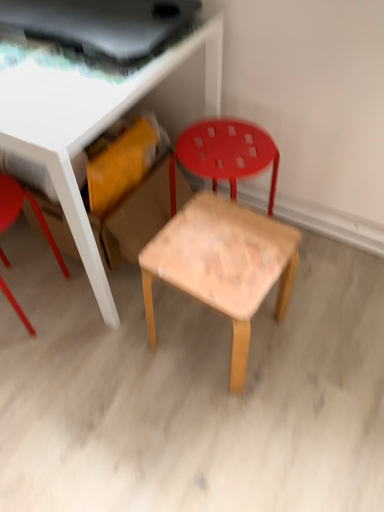
Where is `space that is in front of matte red stool at left, which is the 2th chair from right to left`? This screenshot has width=384, height=512. space that is in front of matte red stool at left, which is the 2th chair from right to left is located at coordinates tap(36, 371).